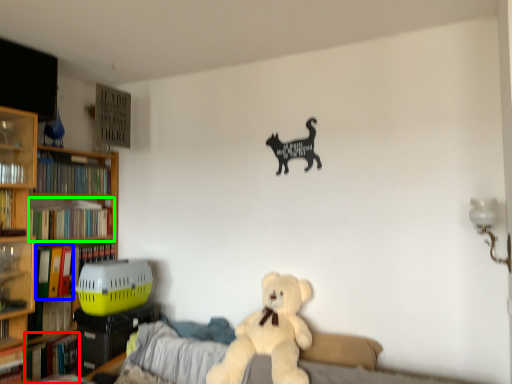
Question: Estimate the real-world distances between objects in this image. Which object is farther from book (highlighted by a red box), book (highlighted by a blue box) or book (highlighted by a green box)?

Choices:
 (A) book
 (B) book

Answer: (B)